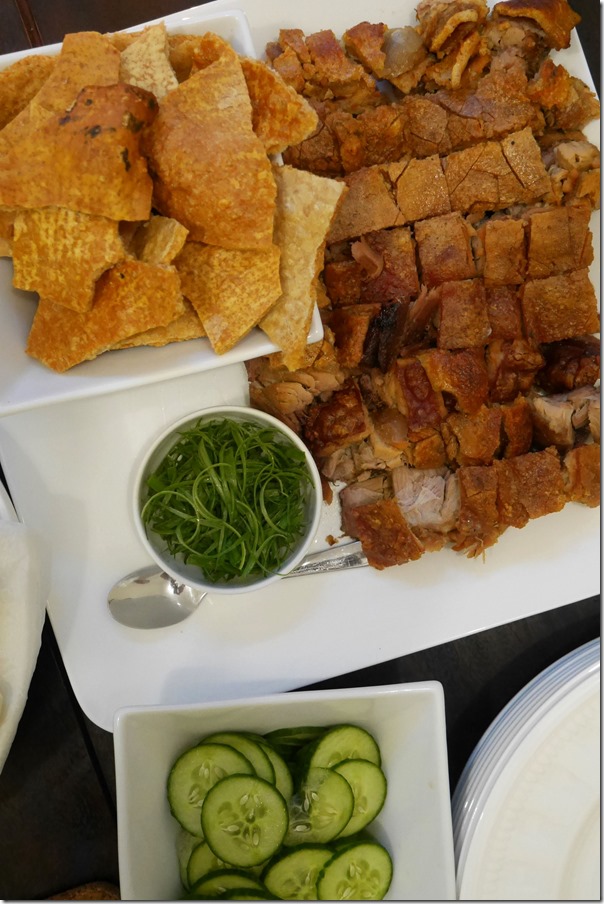
The width and height of the screenshot is (604, 904). In order to click on stack of plates in this screenshot , I will do `click(490, 761)`.